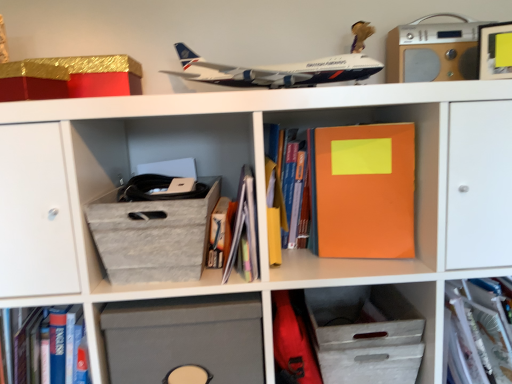
Question: Is orange matte notebook at center oriented away from hardcover book at center, positioned as the 2th book in right-to-left order?

Choices:
 (A) no
 (B) yes

Answer: (A)

Question: Could you tell me if orange matte notebook at center is turned towards hardcover book at center, the third book viewed from the left?

Choices:
 (A) yes
 (B) no

Answer: (B)

Question: From a real-world perspective, is orange matte notebook at center physically above hardcover book at center, positioned as the 2th book in right-to-left order?

Choices:
 (A) no
 (B) yes

Answer: (A)

Question: Can you confirm if orange matte notebook at center is positioned to the left of hardcover book at center, the third book viewed from the left?

Choices:
 (A) no
 (B) yes

Answer: (A)

Question: Does orange matte notebook at center have a greater height compared to hardcover book at center, the third book viewed from the left?

Choices:
 (A) yes
 (B) no

Answer: (B)

Question: From the image's perspective, is hardcover book at center, which appears as the fourth book when viewed from the right, above or below wooden stereo at upper right?

Choices:
 (A) above
 (B) below

Answer: (B)

Question: Looking at the image, does hardcover book at center, which appears as the fourth book when viewed from the right, seem bigger or smaller compared to wooden stereo at upper right?

Choices:
 (A) small
 (B) big

Answer: (A)

Question: From their relative heights in the image, would you say hardcover book at center, which appears as the fourth book when viewed from the right, is taller or shorter than wooden stereo at upper right?

Choices:
 (A) short
 (B) tall

Answer: (A)

Question: From a real-world perspective, relative to wooden stereo at upper right, is hardcover book at center, which is the 1th book from left to right, vertically above or below?

Choices:
 (A) below
 (B) above

Answer: (A)

Question: Is translucent plastic folder at center, the first book in the right-to-left sequence, inside or outside of hardcover book at center, which appears as the fourth book when viewed from the right?

Choices:
 (A) inside
 (B) outside

Answer: (B)

Question: Relative to hardcover book at center, which appears as the fourth book when viewed from the right, is translucent plastic folder at center, which ranks as the 4th book in left-to-right order, in front or behind?

Choices:
 (A) front
 (B) behind

Answer: (B)

Question: In terms of height, does translucent plastic folder at center, which ranks as the 4th book in left-to-right order, look taller or shorter compared to hardcover book at center, which is the 1th book from left to right?

Choices:
 (A) tall
 (B) short

Answer: (A)

Question: From the image's perspective, relative to hardcover book at center, which appears as the fourth book when viewed from the right, is translucent plastic folder at center, which ranks as the 4th book in left-to-right order, above or below?

Choices:
 (A) above
 (B) below

Answer: (B)

Question: Is hardcover book at center, which is the 1th book from left to right, spatially inside matte paper book at center, arranged as the third book when viewed from the right, or outside of it?

Choices:
 (A) outside
 (B) inside

Answer: (B)

Question: Considering the positions of point (223, 240) and point (245, 198), is point (223, 240) closer or farther from the camera than point (245, 198)?

Choices:
 (A) closer
 (B) farther

Answer: (B)